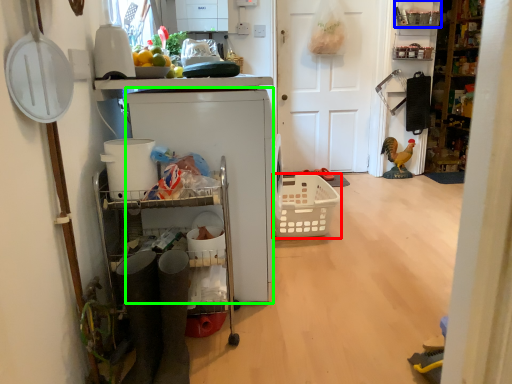
Question: Which is nearer to the basket (highlighted by a red box)? shelf (highlighted by a blue box) or appliance (highlighted by a green box).

Choices:
 (A) shelf
 (B) appliance

Answer: (B)